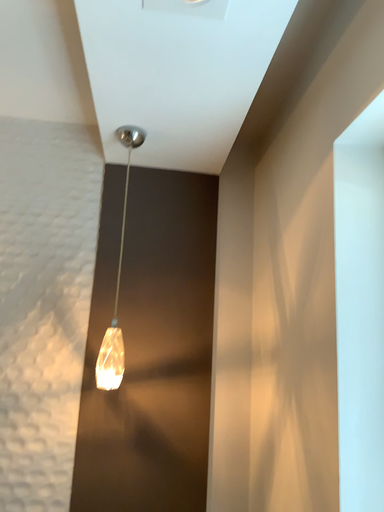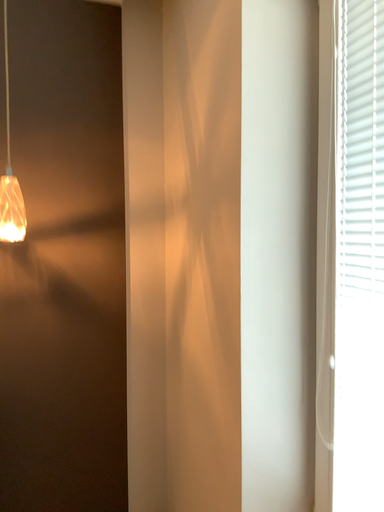
Question: How did the camera likely rotate when shooting the video?

Choices:
 (A) rotated left
 (B) rotated right

Answer: (B)